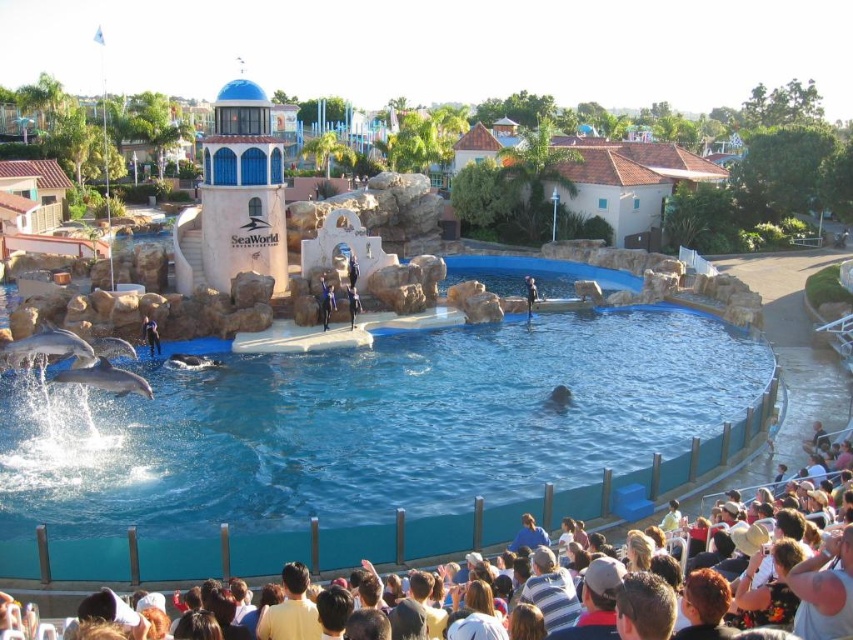
Question: Which is nearer to the blue smooth water at center?

Choices:
 (A) yellow shirt at lower center
 (B) gray matte dolphin at center
 (C) striped shirt at lower center
 (D) gray matte dolphin at lower left

Answer: (B)

Question: Is smooth gray dolphin at lower left to the right of blonde hair at lower center from the viewer's perspective?

Choices:
 (A) no
 (B) yes

Answer: (A)

Question: Is blue smooth water at center below white smooth dolphin at lower left?

Choices:
 (A) no
 (B) yes

Answer: (A)

Question: Based on their relative distances, which object is farther from the striped shirt at lower center?

Choices:
 (A) blonde hair at lower center
 (B) white smooth dolphin at lower left

Answer: (B)

Question: Does white cotton crowd at lower center appear over yellow shirt at lower center?

Choices:
 (A) no
 (B) yes

Answer: (B)

Question: Which point appears closest to the camera in this image?

Choices:
 (A) (491, 618)
 (B) (564, 576)

Answer: (A)